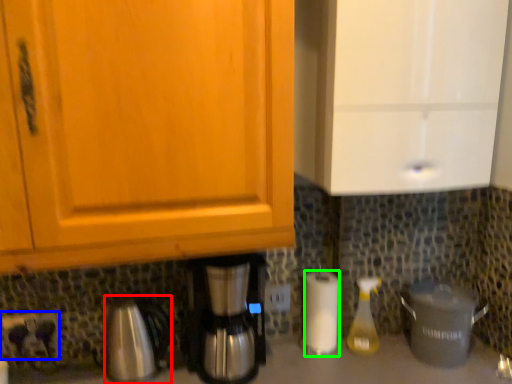
Question: Estimate the real-world distances between objects in this image. Which object is farther from coffeepot (highlighted by a red box), power plugs and sockets (highlighted by a blue box) or paper towel (highlighted by a green box)?

Choices:
 (A) power plugs and sockets
 (B) paper towel

Answer: (B)